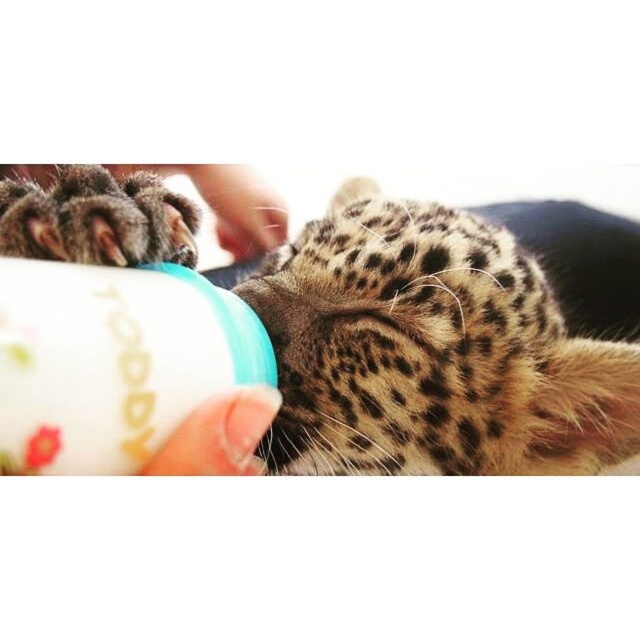
You are a wildlife photographer holding a camera 12 inches wide. You want to take a photo of the spotted fur leopard at center from your current position. Can your camera fit entirely within the leopard? Please explain.

The spotted fur leopard at center and the viewer are 32.32 inches apart. The camera is 12 inches wide. Since the leopard is an animal and the camera is being held by the photographer, the camera cannot fit entirely within the leopard. The question seems to have a misunderstanding. The photographer should ensure they are positioned appropriately to capture the leopard within the camera frame without overlapping physically.

Based on the scene description, which object is positioned higher in the image, the spotted fur leopard at center or the white plastic bottle at center?

The spotted fur leopard at center is located below the white plastic bottle at center, so the white plastic bottle at center is positioned higher.

You are a wildlife photographer trying to capture a close shot of the spotted fur leopard at center and the white plastic bottle at center. If you want to ensure both are in focus, which one should you adjust your camera focus to prioritize based on their sizes?

The spotted fur leopard at center is larger in width than the white plastic bottle at center, so you should prioritize focusing on the leopard to ensure both are in focus.